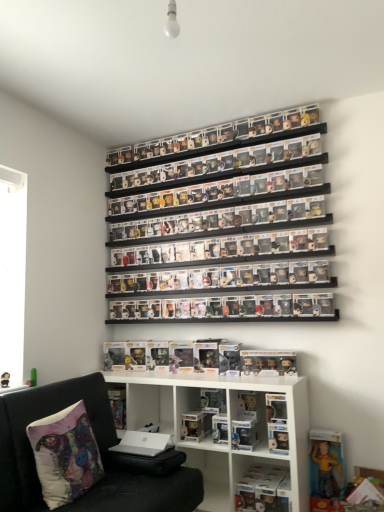
Question: Is clear plastic figures at upper center, marked as the 1th shelf in a top-to-bottom arrangement, oriented towards clear plastic figure at lower center?

Choices:
 (A) no
 (B) yes

Answer: (A)

Question: Can you confirm if clear plastic figures at upper center, marked as the 1th shelf in a top-to-bottom arrangement, is shorter than clear plastic figure at lower center?

Choices:
 (A) yes
 (B) no

Answer: (A)

Question: Could clear plastic figure at lower center be considered to be inside clear plastic figures at upper center, marked as the 1th shelf in a top-to-bottom arrangement?

Choices:
 (A) no
 (B) yes

Answer: (A)

Question: Considering the relative positions of clear plastic figures at upper center, marked as the 1th shelf in a top-to-bottom arrangement, and clear plastic figure at lower center in the image provided, is clear plastic figures at upper center, marked as the 1th shelf in a top-to-bottom arrangement, to the right of clear plastic figure at lower center from the viewer's perspective?

Choices:
 (A) no
 (B) yes

Answer: (A)

Question: From a real-world perspective, is clear plastic figures at upper center, marked as the 1th shelf in a top-to-bottom arrangement, below clear plastic figure at lower center?

Choices:
 (A) yes
 (B) no

Answer: (B)

Question: From their relative heights in the image, would you say translucent plastic figures at lower center, marked as the second toy in a right-to-left arrangement, is taller or shorter than clear plastic figure at lower center?

Choices:
 (A) tall
 (B) short

Answer: (B)

Question: Visually, is translucent plastic figures at lower center, acting as the third toy starting from the bottom, positioned to the left or to the right of clear plastic figure at lower center?

Choices:
 (A) right
 (B) left

Answer: (A)

Question: From a real-world perspective, is translucent plastic figures at lower center, marked as the second toy in a left-to-right arrangement, above or below clear plastic figure at lower center?

Choices:
 (A) above
 (B) below

Answer: (A)

Question: Considering the positions of translucent plastic figures at lower center, marked as the first toy in a top-to-bottom arrangement, and clear plastic figure at lower center in the image, is translucent plastic figures at lower center, marked as the first toy in a top-to-bottom arrangement, bigger or smaller than clear plastic figure at lower center?

Choices:
 (A) small
 (B) big

Answer: (A)

Question: In terms of size, does white fabric pillow with colorful design at lower left appear bigger or smaller than clear plastic figures at center, which ranks as the third shelf in bottom-to-top order?

Choices:
 (A) big
 (B) small

Answer: (A)

Question: In terms of height, does white fabric pillow with colorful design at lower left look taller or shorter compared to clear plastic figures at center, which appears as the 2th shelf when viewed from the top?

Choices:
 (A) short
 (B) tall

Answer: (B)

Question: Would you say white fabric pillow with colorful design at lower left is inside or outside clear plastic figures at center, which ranks as the third shelf in bottom-to-top order?

Choices:
 (A) outside
 (B) inside

Answer: (A)

Question: Considering the positions of point (76, 401) and point (124, 199), is point (76, 401) closer or farther from the camera than point (124, 199)?

Choices:
 (A) farther
 (B) closer

Answer: (B)

Question: Relative to white matte shelf at lower center, arranged as the first shelf when ordered from the bottom, is clear plastic figures at center, which appears as the 2th shelf when viewed from the top, in front or behind?

Choices:
 (A) front
 (B) behind

Answer: (B)

Question: In terms of width, does clear plastic figures at center, which ranks as the third shelf in bottom-to-top order, look wider or thinner when compared to white matte shelf at lower center, arranged as the first shelf when ordered from the bottom?

Choices:
 (A) thin
 (B) wide

Answer: (A)